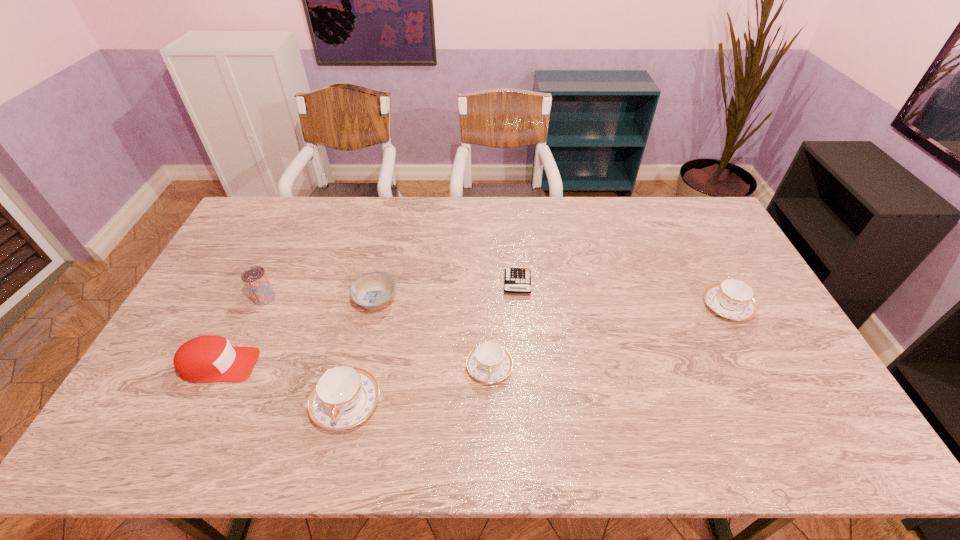
If the aim is uniform spacing by inserting an additional teacup among them, please point to a vacant space for this new teacup. Please provide its 2D coordinates. Your answer should be formatted as a tuple, i.e. [(x, y)], where the tuple contains the x and y coordinates of a point satisfying the conditions above.

[(615, 335)]